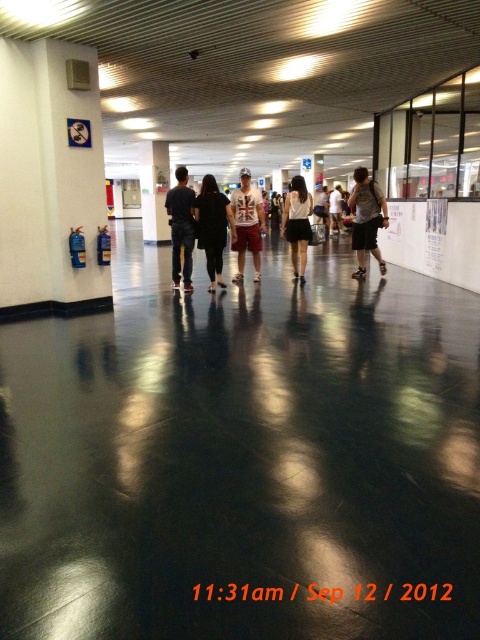
Question: Which point is closer to the camera?

Choices:
 (A) (250, 214)
 (B) (352, 275)
 (C) (173, 288)
 (D) (210, 193)

Answer: (D)

Question: Based on their relative distances, which object is farther from the black matte jacket at center?

Choices:
 (A) matte black shorts at center
 (B) white matte dress at center
 (C) matte black backpack at center

Answer: (A)

Question: Considering the relative positions of black matte jacket at center and matte white tank top at center in the image provided, where is black matte jacket at center located with respect to matte white tank top at center?

Choices:
 (A) left
 (B) right

Answer: (A)

Question: Based on their relative distances, which object is nearer to the dark blue jeans at center?

Choices:
 (A) matte black backpack at center
 (B) black matte jacket at center
 (C) white matte dress at center
 (D) matte white tank top at center

Answer: (B)

Question: Can you confirm if dark blue jeans at center is positioned above black matte roller skate at center?

Choices:
 (A) no
 (B) yes

Answer: (B)

Question: Is dark blue jeans at center further to the viewer compared to black matte roller skate at center?

Choices:
 (A) no
 (B) yes

Answer: (A)